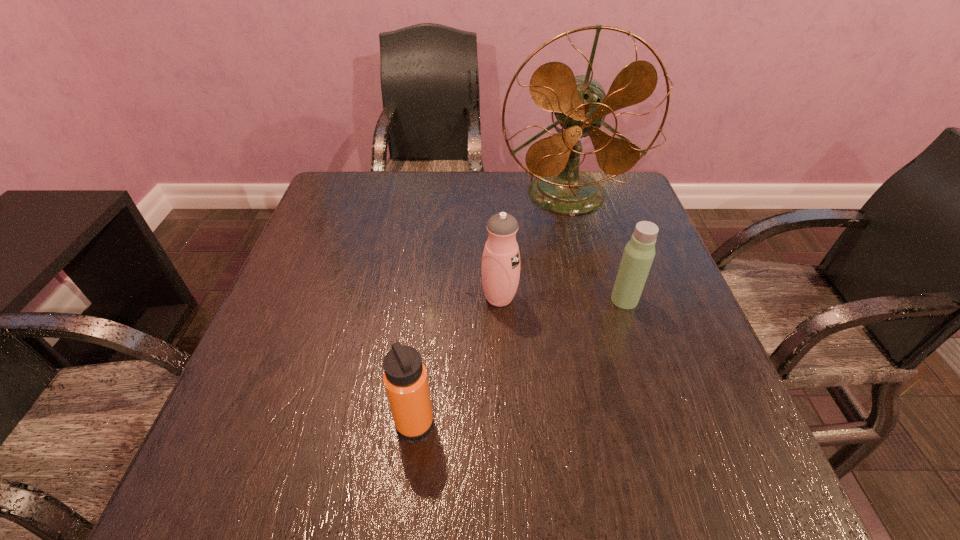
In order to click on thermos bottle object that ranks as the closest to the second thermos bottle from right to left in this screenshot , I will do `click(639, 252)`.

Identify the location of thermos bottle that can be found as the third closest to the fan. This screenshot has height=540, width=960. (405, 378).

At what (x,y) coordinates should I click in order to perform the action: click on free space that satisfies the following two spatial constraints: 1. on the back side of the rightmost thermos bottle; 2. on the left side of the leftmost thermos bottle. Please return your answer as a coordinate pair (x, y). This screenshot has width=960, height=540. Looking at the image, I should click on (428, 300).